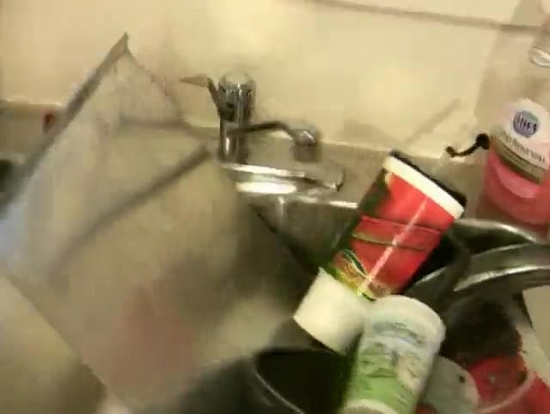
At what (x,y) coordinates should I click in order to perform the action: click on metal sink handle. Please return your answer as a coordinate pair (x, y). This screenshot has height=414, width=550. Looking at the image, I should click on (221, 108).